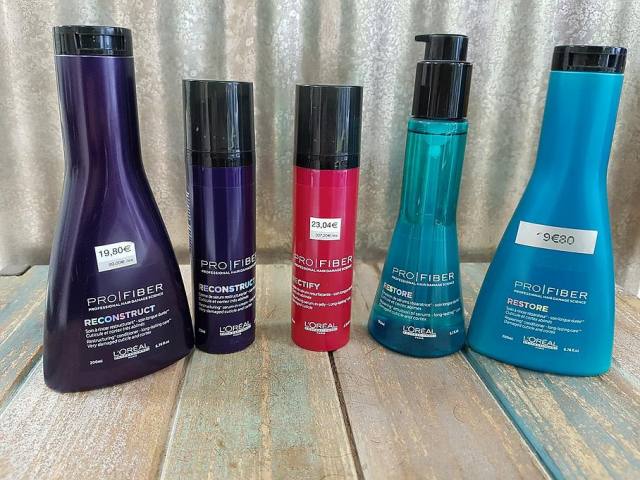
The height and width of the screenshot is (480, 640). Identify the location of wooden surface. (10, 320), (61, 422), (248, 426), (475, 423), (600, 405), (634, 360).